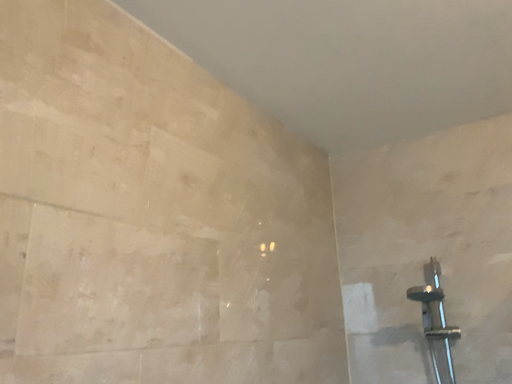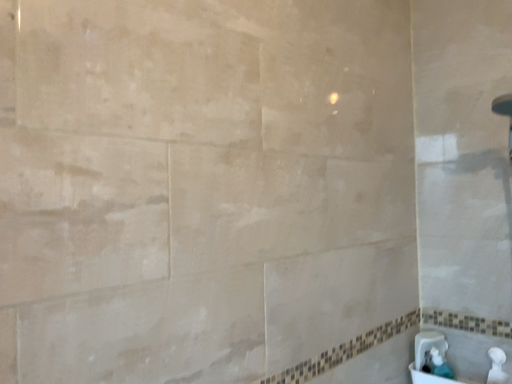
Question: How did the camera likely rotate when shooting the video?

Choices:
 (A) rotated right
 (B) rotated left

Answer: (B)